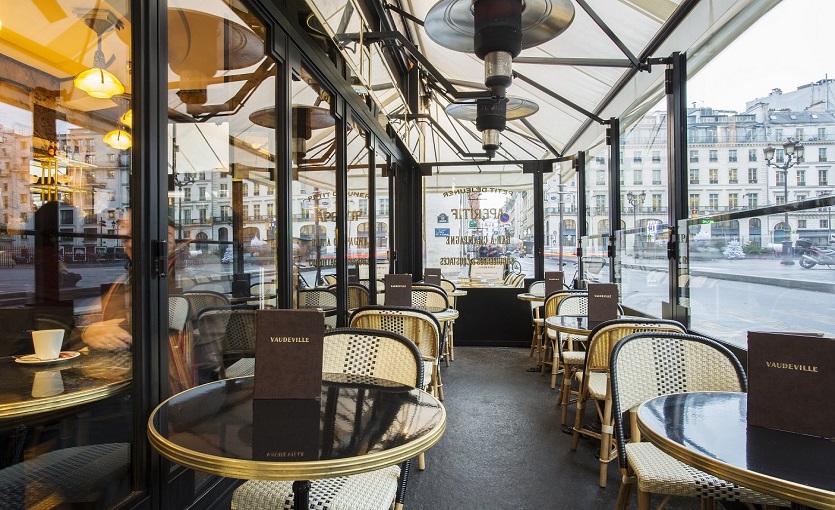
At what (x,y) coordinates should I click in order to perform the action: click on table top. Please return your answer as a coordinate pair (x, y). Image resolution: width=835 pixels, height=510 pixels. Looking at the image, I should click on (342, 417), (676, 421), (575, 324), (438, 310), (534, 293), (496, 285), (469, 278), (63, 378), (322, 307).